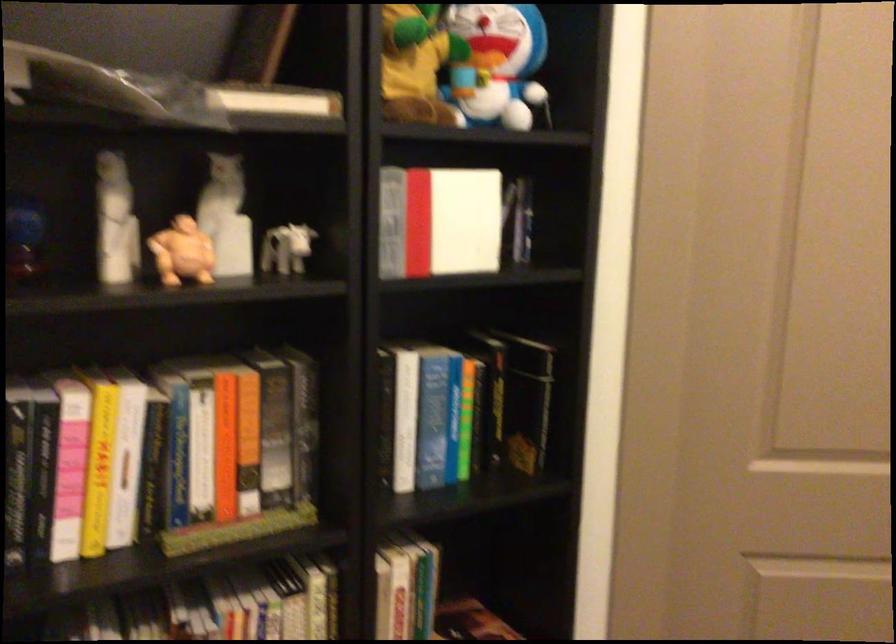
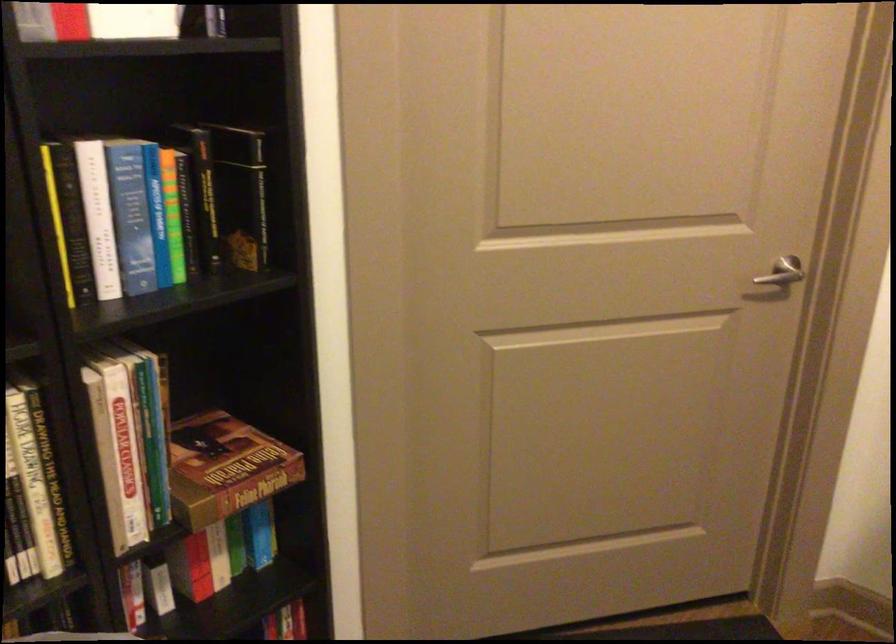
Question: The camera is either moving clockwise (left) or counter-clockwise (right) around the object. The first image is from the beginning of the video and the second image is from the end. Is the camera moving left or right when shooting the video?

Choices:
 (A) Left
 (B) Right

Answer: (A)